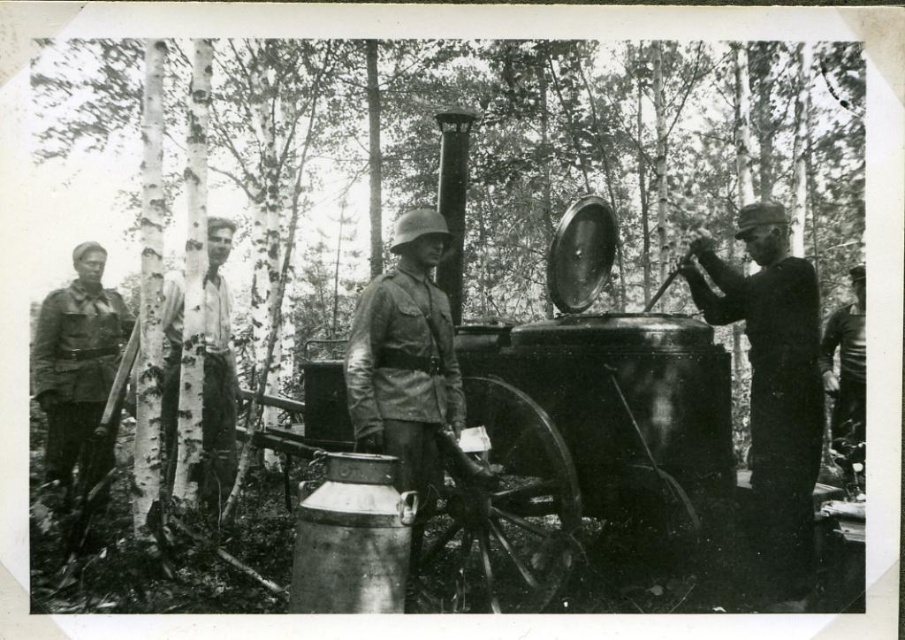
Question: Does camouflage fabric uniform at center appear on the right side of white cotton shirt at center?

Choices:
 (A) no
 (B) yes

Answer: (B)

Question: Considering the real-world distances, which object is farthest from the camouflage fabric uniform at left?

Choices:
 (A) white cotton shirt at center
 (B) smooth leather jacket at right

Answer: (B)

Question: Which point appears closest to the camera in this image?

Choices:
 (A) (97, 458)
 (B) (362, 433)
 (C) (786, 225)
 (D) (205, 492)

Answer: (B)

Question: Which point is farther to the camera?

Choices:
 (A) (35, 340)
 (B) (761, 268)
 (C) (459, 385)

Answer: (A)

Question: Can you confirm if uniformed man at right is bigger than camouflage fabric uniform at center?

Choices:
 (A) yes
 (B) no

Answer: (A)

Question: Is camouflage fabric uniform at left in front of white cotton shirt at center?

Choices:
 (A) no
 (B) yes

Answer: (A)